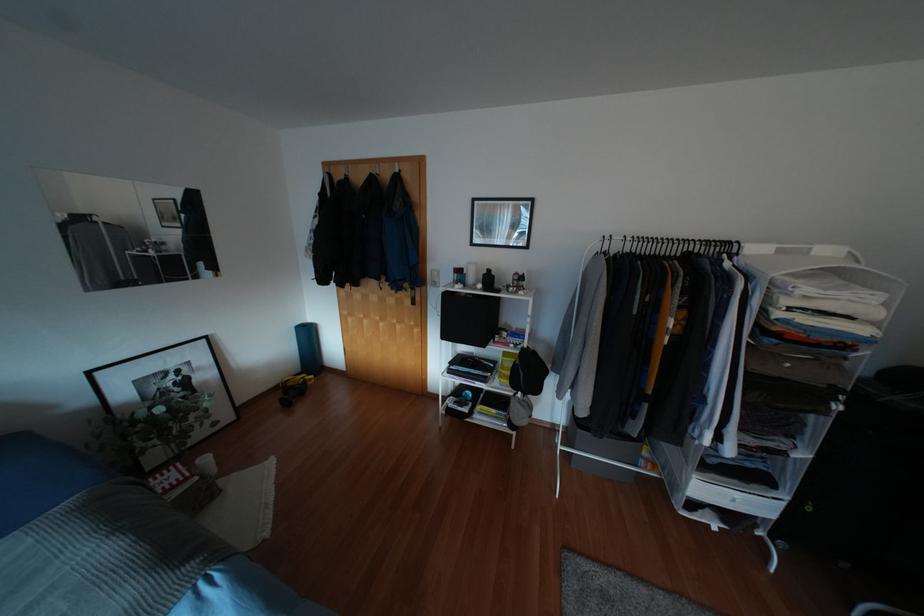
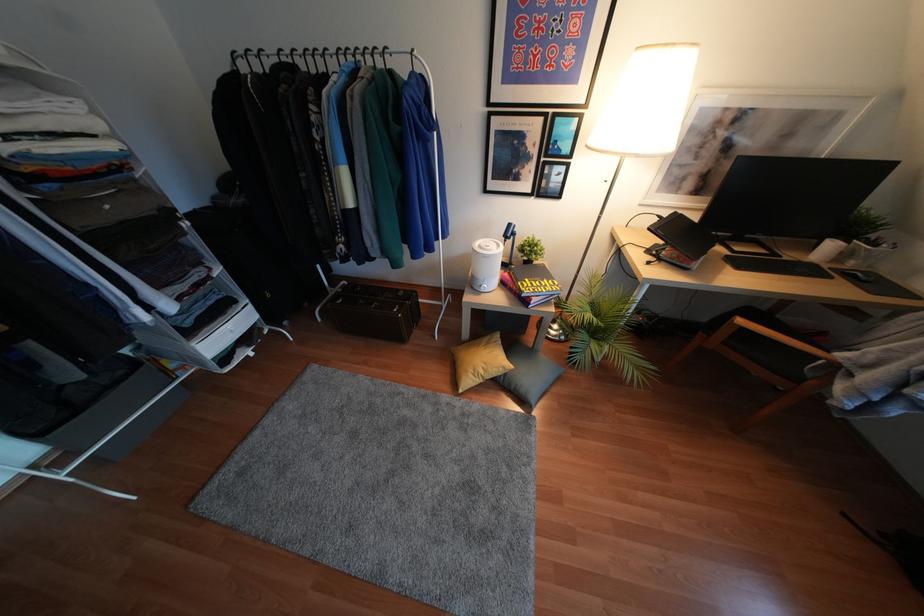
Based on the continuous images, in which direction is the camera rotating?

The rotation direction of the camera is right-down.